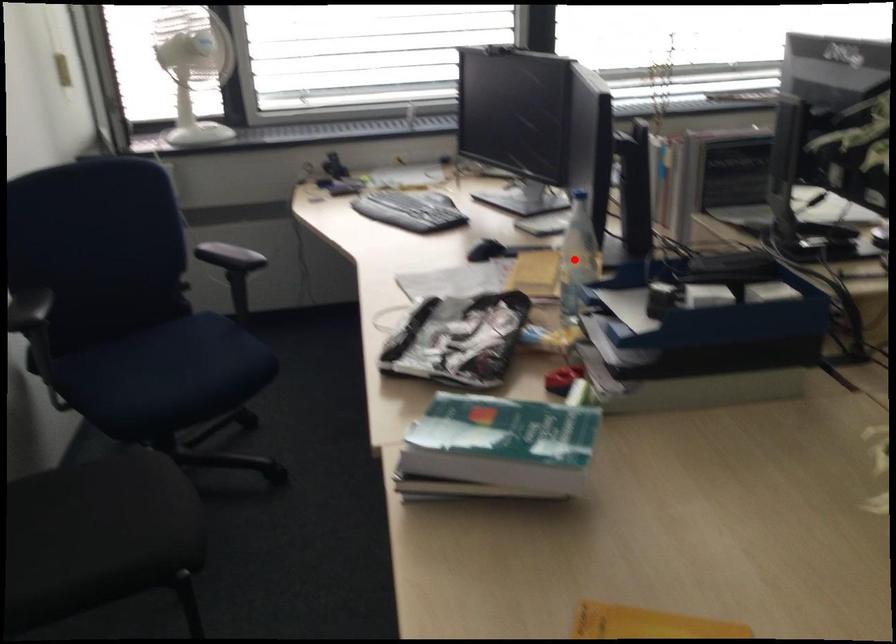
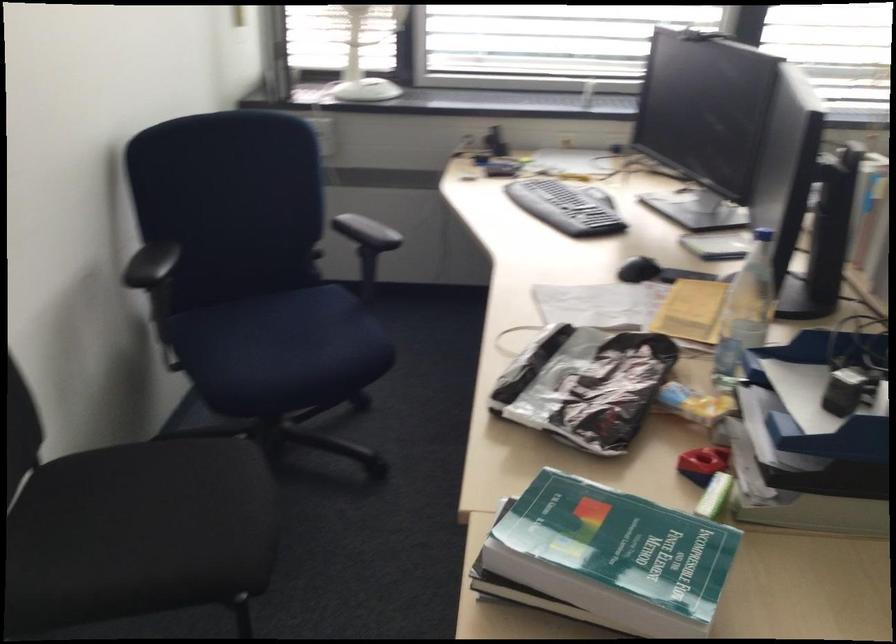
In the second image, find the point that corresponds to the highlighted location in the first image.

(745, 310)